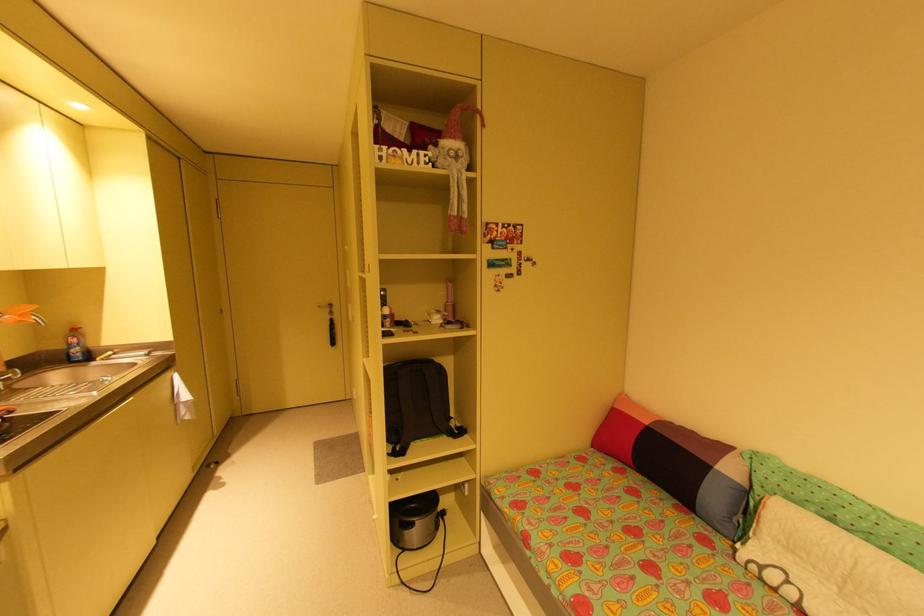
You are a GUI agent. You are given a task and a screenshot of the screen. Output one action in this format:
    pyautogui.click(x=<x>, y=<y>)
    Task: Click on the silver cooking pot
    
    Given the screenshot: What is the action you would take?
    pyautogui.click(x=414, y=521)